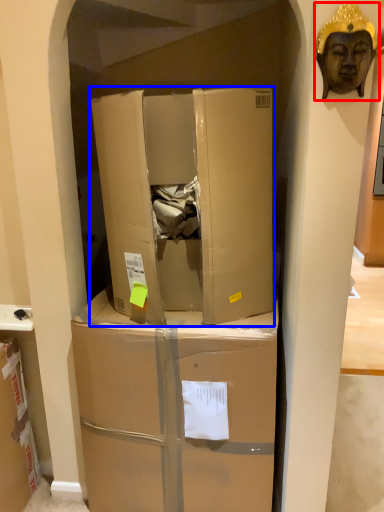
Question: Which object is further to the camera taking this photo, person (highlighted by a red box) or box (highlighted by a blue box)?

Choices:
 (A) person
 (B) box

Answer: (B)